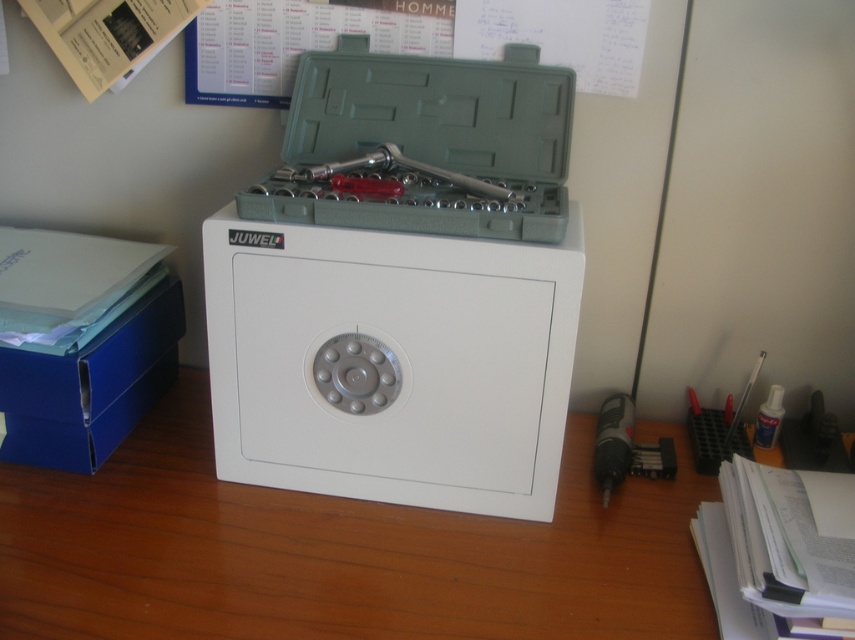
Is point (363, 580) less distant than point (154, 330)?

Yes, it is.

What do you see at coordinates (338, 552) in the screenshot? I see `white wood table at center` at bounding box center [338, 552].

Between point (258, 532) and point (122, 333), which one is positioned behind?

Point (122, 333)

Find the location of a particular element. white wood table at center is located at coordinates (338, 552).

Can you confirm if white plastic toolbox at center is positioned below white wood table at center?

Actually, white plastic toolbox at center is above white wood table at center.

Does point (399, 280) lie in front of point (379, 554)?

Yes, it is.

Locate an element on the screen. Image resolution: width=855 pixels, height=640 pixels. white plastic toolbox at center is located at coordinates (404, 288).

Does white plastic toolbox at center have a lesser width compared to blue cardboard box at left?

No.

Who is taller, white plastic toolbox at center or blue cardboard box at left?

white plastic toolbox at center is taller.

Find the location of a particular element. The width and height of the screenshot is (855, 640). white plastic toolbox at center is located at coordinates (404, 288).